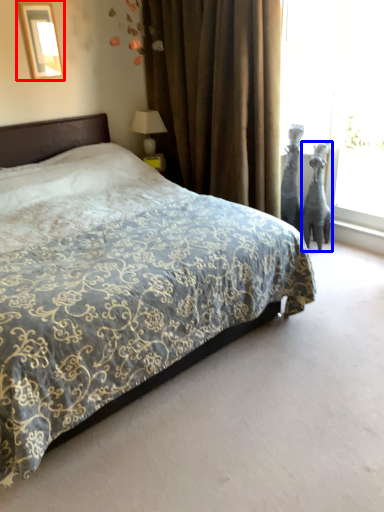
Question: Which of the following is the closest to the observer, picture frame (highlighted by a red box) or animal (highlighted by a blue box)?

Choices:
 (A) picture frame
 (B) animal

Answer: (A)